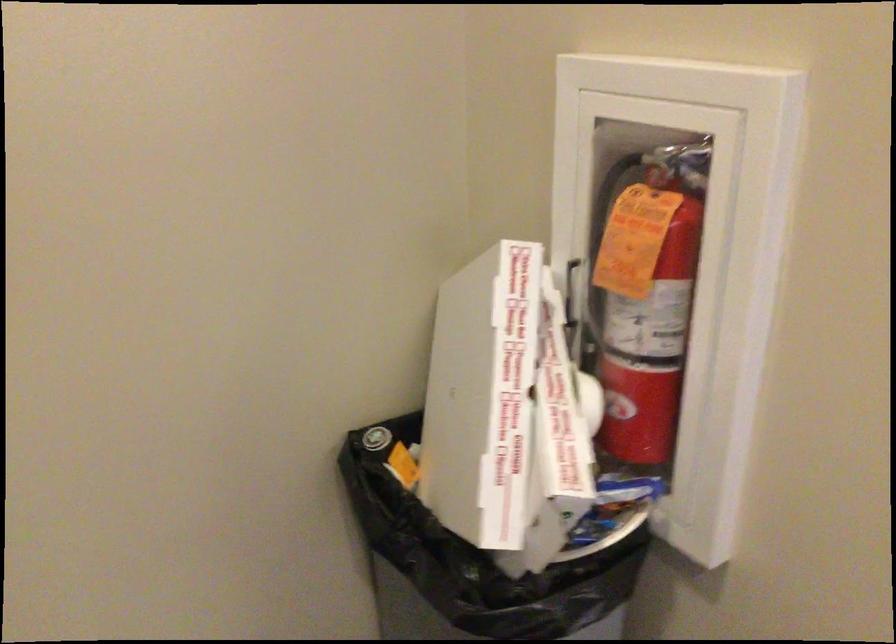
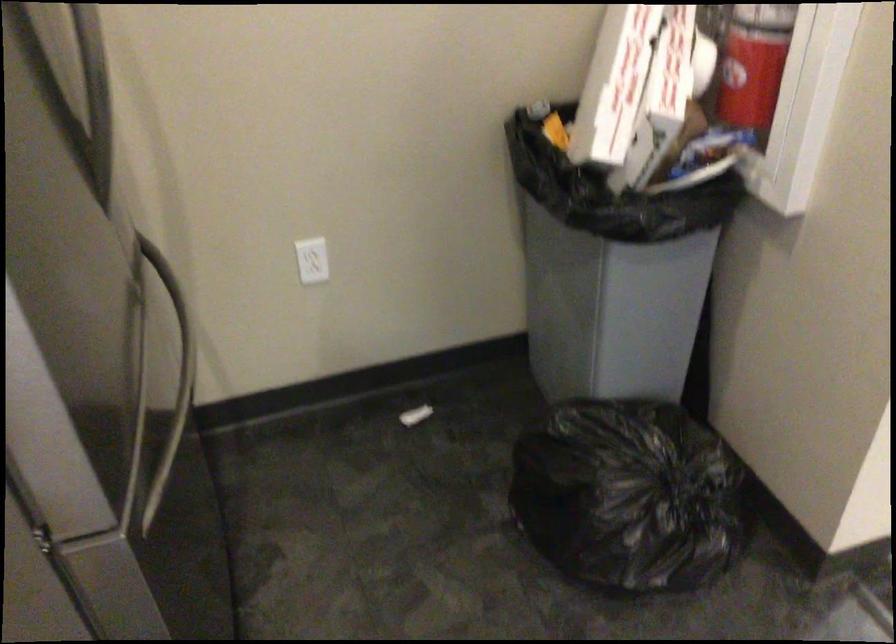
The point at (x=642, y=402) is marked in the first image. Where is the corresponding point in the second image?

(754, 64)